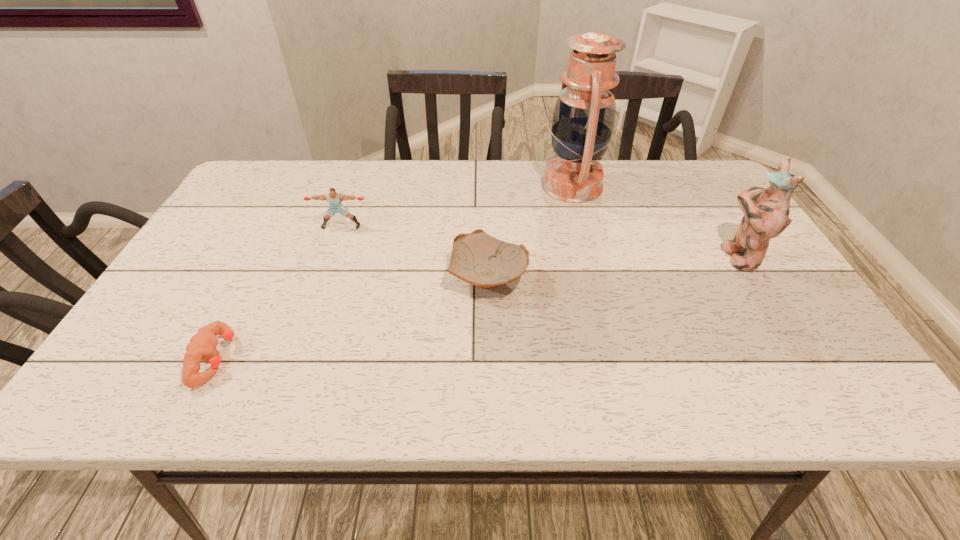
Image resolution: width=960 pixels, height=540 pixels. I want to click on the tallest object, so click(x=583, y=120).

At what (x,y) coordinates should I click in order to perform the action: click on the farthest object. Please return your answer as a coordinate pair (x, y). The width and height of the screenshot is (960, 540). Looking at the image, I should click on (583, 120).

You are a GUI agent. You are given a task and a screenshot of the screen. Output one action in this format:
    pyautogui.click(x=<x>, y=<y>)
    Task: Click on the figurine
    The image size is (960, 540).
    Given the screenshot: What is the action you would take?
    pyautogui.click(x=766, y=210)

The image size is (960, 540). In order to click on the rightmost object in this screenshot , I will do `click(766, 210)`.

This screenshot has height=540, width=960. I want to click on the third shortest object, so click(335, 199).

At what (x,y) coordinates should I click in order to perform the action: click on the fourth nearest object. Please return your answer as a coordinate pair (x, y). Looking at the image, I should click on (335, 199).

The height and width of the screenshot is (540, 960). I want to click on the third object from right to left, so click(478, 258).

Identify the location of the second shortest object. This screenshot has width=960, height=540. (478, 258).

In order to click on the left puncher in this screenshot , I will do `click(202, 346)`.

The image size is (960, 540). In order to click on the shortest object in this screenshot , I will do click(x=202, y=346).